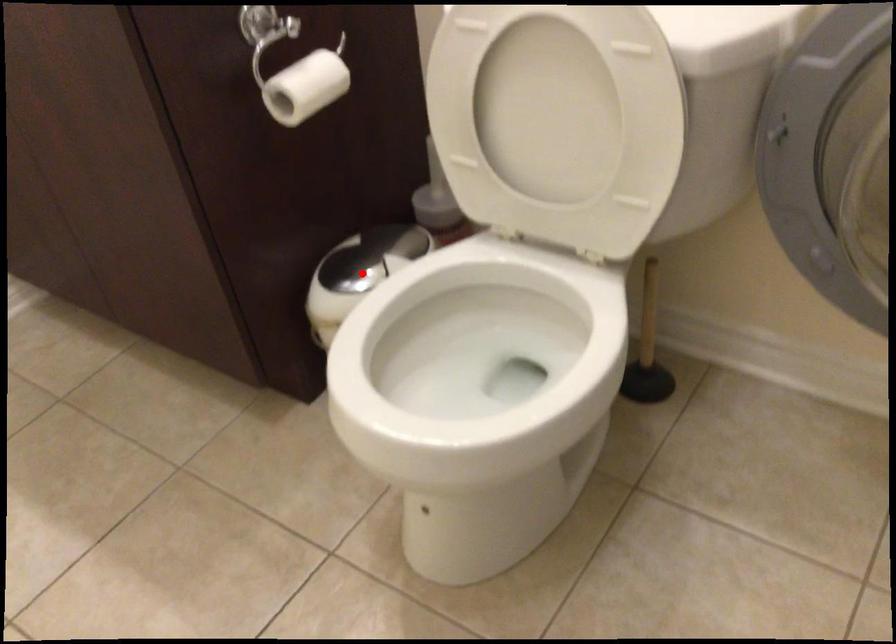
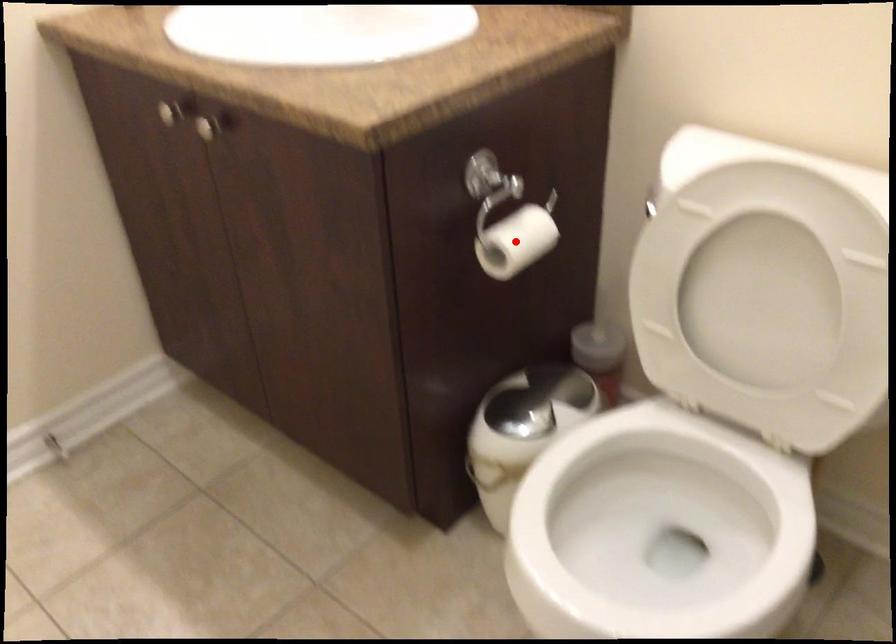
I am providing you with two images of the same scene from different viewpoints. A red point is marked on the first image and another point is marked on the second image. Do the highlighted points in image1 and image2 indicate the same real-world spot?

No